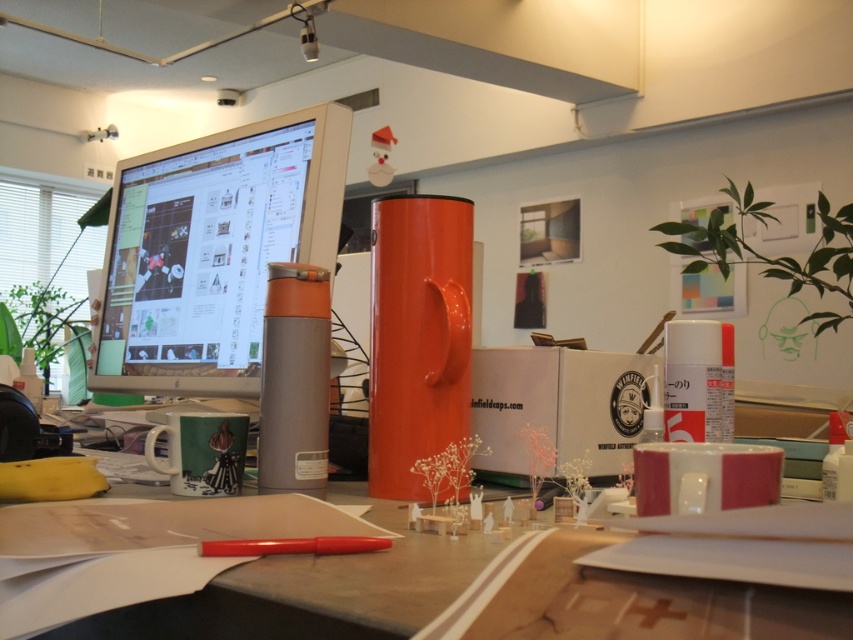
Question: From the image, what is the correct spatial relationship of satin silver monitor at upper left in relation to matte plastic desk at center?

Choices:
 (A) right
 (B) left

Answer: (B)

Question: Can you confirm if satin silver monitor at upper left is positioned to the left of matte plastic desk at center?

Choices:
 (A) no
 (B) yes

Answer: (B)

Question: Is satin silver monitor at upper left to the left of matte plastic desk at center from the viewer's perspective?

Choices:
 (A) yes
 (B) no

Answer: (A)

Question: Which object appears farthest from the camera in this image?

Choices:
 (A) satin silver monitor at upper left
 (B) matte plastic desk at center

Answer: (A)